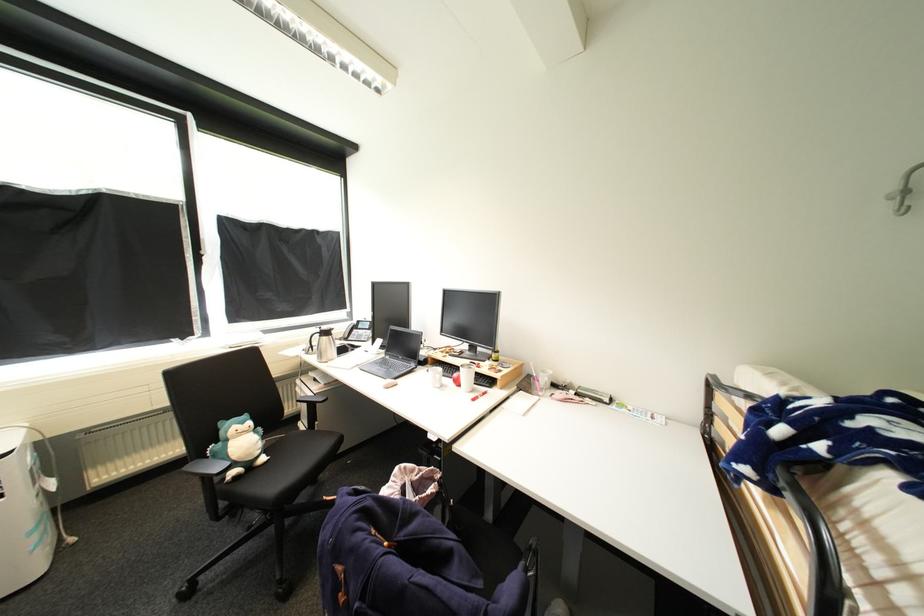
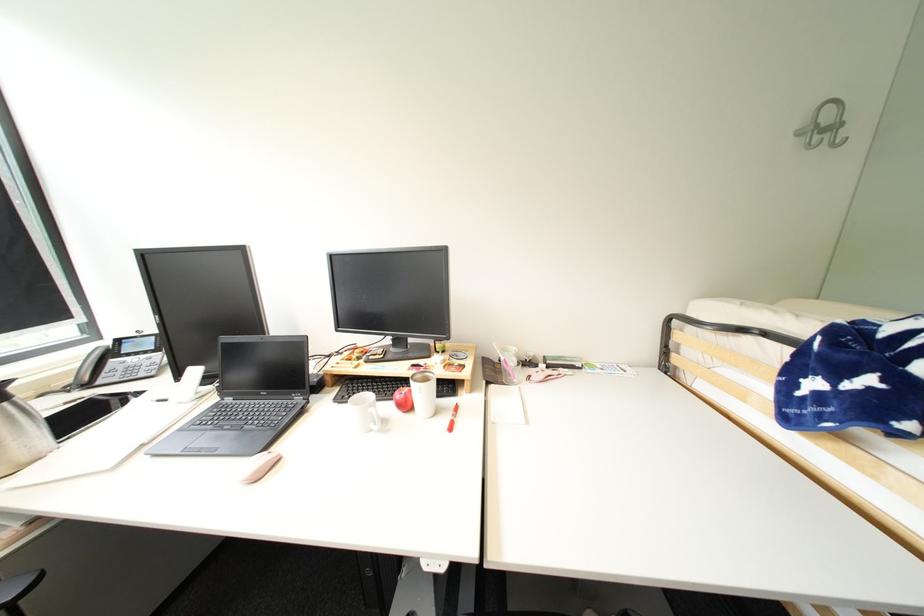
Question: The images are taken continuously from a first-person perspective. In which direction is your viewpoint rotating?

Choices:
 (A) Left
 (B) Right
 (C) Up
 (D) Down

Answer: (B)